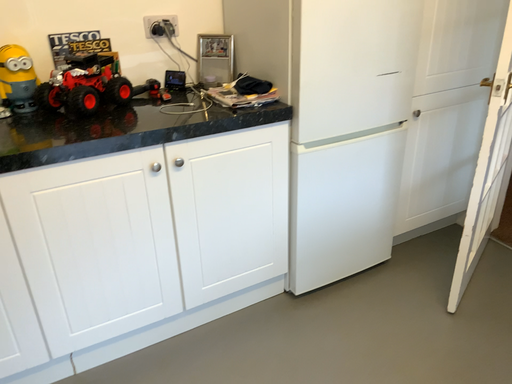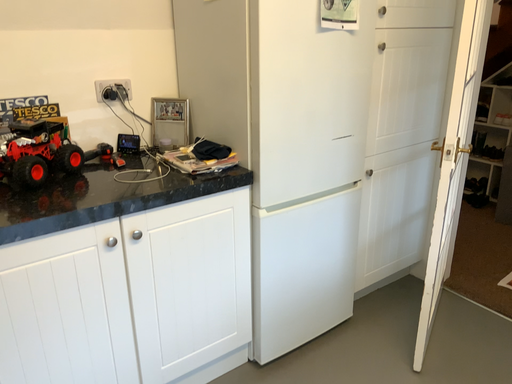
Question: How did the camera likely rotate when shooting the video?

Choices:
 (A) rotated right
 (B) rotated left

Answer: (A)